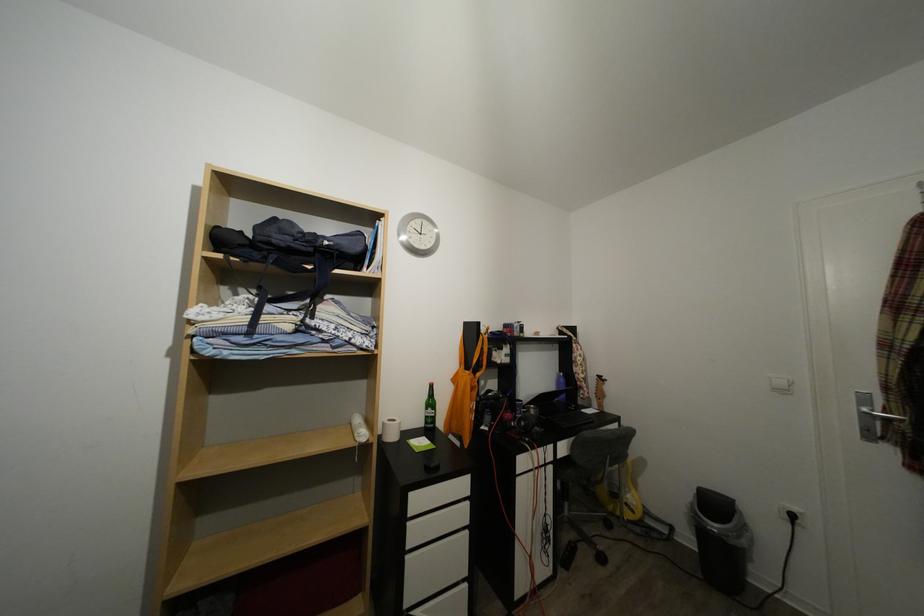
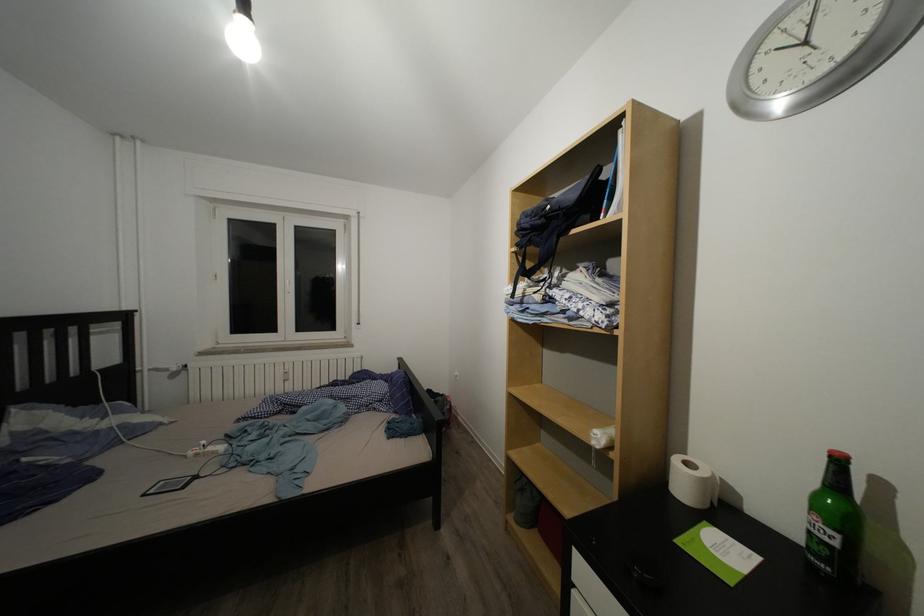
Question: How did the camera likely rotate?

Choices:
 (A) Left
 (B) Right
 (C) Up
 (D) Down

Answer: (A)